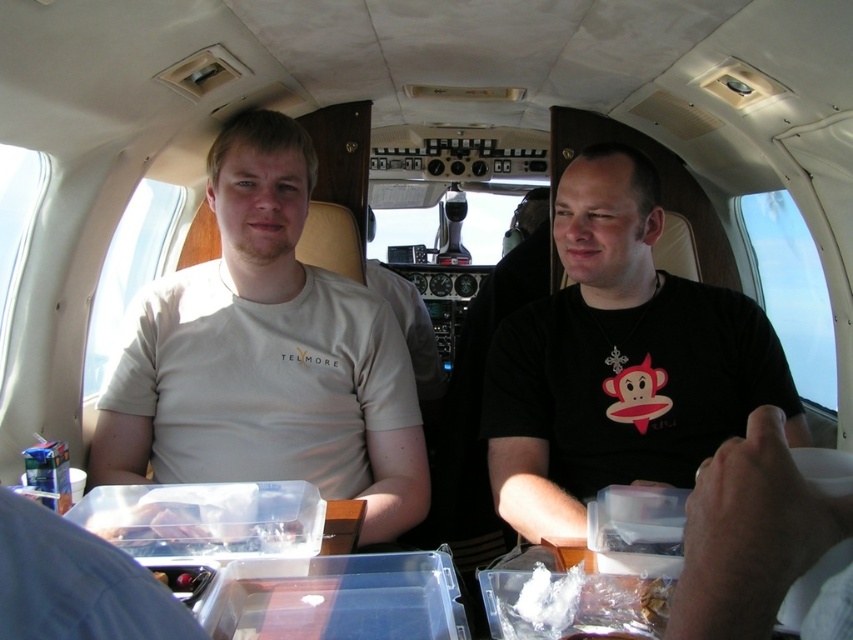
Question: Is black matte t-shirt at center above white crumbly food at lower center?

Choices:
 (A) no
 (B) yes

Answer: (B)

Question: Is white matte t-shirt at center bigger than black matte t-shirt at center?

Choices:
 (A) yes
 (B) no

Answer: (B)

Question: Among these points, which one is farthest from the camera?

Choices:
 (A) (610, 588)
 (B) (256, 353)

Answer: (B)

Question: Which object is positioned farthest from the white crumbly food at lower center?

Choices:
 (A) white matte t-shirt at center
 (B) black matte t-shirt at center

Answer: (A)

Question: Which point is closer to the camera?

Choices:
 (A) (294, 385)
 (B) (534, 592)
 (C) (547, 346)

Answer: (B)

Question: Does white matte t-shirt at center come behind black matte t-shirt at center?

Choices:
 (A) no
 (B) yes

Answer: (B)